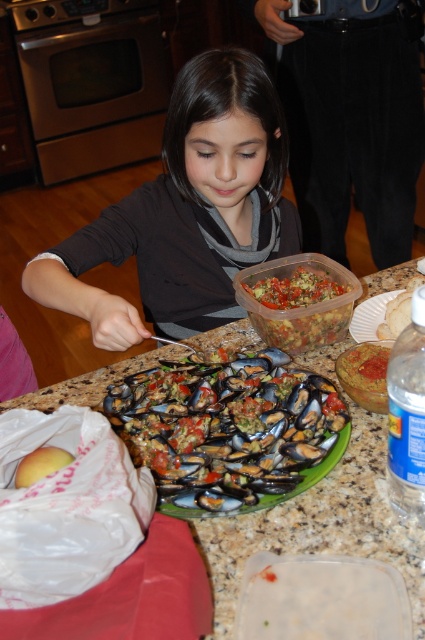
Question: Can you confirm if shiny black mussels at center is bigger than white crumbly pastry at center?

Choices:
 (A) yes
 (B) no

Answer: (A)

Question: Observing the image, what is the correct spatial positioning of shiny black mussels at center in reference to translucent plastic container at center?

Choices:
 (A) left
 (B) right

Answer: (A)

Question: Does matte black shirt at center appear over translucent plastic container at center?

Choices:
 (A) no
 (B) yes

Answer: (B)

Question: Based on their relative distances, which object is nearer to the white crumbly pastry at center?

Choices:
 (A) matte black shirt at center
 (B) shiny black mussels at center

Answer: (B)

Question: Which object is positioned closest to the white crumbly pastry at center?

Choices:
 (A) green marble table at center
 (B) matte black shirt at center
 (C) yellow smooth mango at lower left
 (D) shiny black mussels at center

Answer: (A)

Question: Which object is the closest to the white crumbly pastry at center?

Choices:
 (A) shiny black mussels at center
 (B) matte black shirt at center
 (C) green marble table at center
 (D) translucent plastic container at center

Answer: (D)